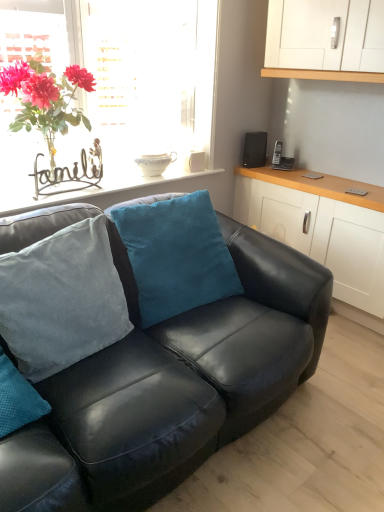
Describe the element at coordinates (255, 149) in the screenshot. I see `black matte speaker at upper right` at that location.

What do you see at coordinates (62, 298) in the screenshot?
I see `velvet blue pillow at center, placed as the second pillow when sorted from right to left` at bounding box center [62, 298].

Identify the location of glass vase at upper left. (118, 95).

In order to face teal velvety pillow at center, placed as the second pillow when sorted from left to right, should I rotate leftwards or rightwards?

It's best to rotate left around 1.633 degrees.

This screenshot has height=512, width=384. What do you see at coordinates (171, 257) in the screenshot?
I see `teal velvety pillow at center, placed as the second pillow when sorted from left to right` at bounding box center [171, 257].

Measure the distance between point (218,386) and camera.

Point (218,386) is 4.85 feet away from camera.

Where is `white ceramic bowl at upper center`? The height and width of the screenshot is (512, 384). white ceramic bowl at upper center is located at coordinates (110, 190).

Locate an element on the screen. white matte cabinet at right is located at coordinates (323, 231).

This screenshot has height=512, width=384. Identify the location of black matte speaker at upper right. (255, 149).

Is matte metal sign at upper left completely or partially outside of white ceramic bowl at upper center?

Yes, matte metal sign at upper left is not within white ceramic bowl at upper center.

Are matte metal sign at upper left and white ceramic bowl at upper center making contact?

matte metal sign at upper left is not next to white ceramic bowl at upper center, and they're not touching.

From a real-world perspective, which is physically above, matte metal sign at upper left or white ceramic bowl at upper center?

matte metal sign at upper left.

Is white matte cabinet at right far away from velvet blue pillow at center, placed as the second pillow when sorted from right to left?

Yes, white matte cabinet at right is far from velvet blue pillow at center, placed as the second pillow when sorted from right to left.

Considering the sizes of objects white matte cabinet at right and velvet blue pillow at center, which is the first pillow in left-to-right order, in the image provided, who is wider, white matte cabinet at right or velvet blue pillow at center, which is the first pillow in left-to-right order,?

white matte cabinet at right is wider.

Between white matte cabinet at right and velvet blue pillow at center, placed as the second pillow when sorted from right to left, which one appears on the right side from the viewer's perspective?

white matte cabinet at right.

Could you measure the distance between white matte cabinet at right and velvet blue pillow at center, which is the first pillow in left-to-right order?

white matte cabinet at right and velvet blue pillow at center, which is the first pillow in left-to-right order, are 1.48 meters apart from each other.

Is black matte speaker at upper right situated inside white ceramic bowl at upper center or outside?

black matte speaker at upper right lies outside white ceramic bowl at upper center.

The height and width of the screenshot is (512, 384). Find the location of `window sill beneath the black matte speaker at upper right (from a real-world perspective)`. window sill beneath the black matte speaker at upper right (from a real-world perspective) is located at coordinates (110, 190).

Would you consider black matte speaker at upper right to be distant from white ceramic bowl at upper center?

That's not correct — black matte speaker at upper right is a little close to white ceramic bowl at upper center.

From a real-world perspective, which is physically below, black matte speaker at upper right or white ceramic bowl at upper center?

white ceramic bowl at upper center is physically lower.

Can you tell me how much teal velvety pillow at center, placed as the second pillow when sorted from left to right, and white ceramic bowl at upper center differ in facing direction?

They differ by 14.3 degrees in their facing directions.

Can you confirm if teal velvety pillow at center, placed as the second pillow when sorted from left to right, is smaller than white ceramic bowl at upper center?

Incorrect, teal velvety pillow at center, placed as the second pillow when sorted from left to right, is not smaller in size than white ceramic bowl at upper center.

Which object is positioned more to the right, teal velvety pillow at center, placed as the second pillow when sorted from left to right, or white ceramic bowl at upper center?

teal velvety pillow at center, placed as the second pillow when sorted from left to right.

Based on the photo, is teal velvety pillow at center, placed as the second pillow when sorted from left to right, thinner than white ceramic bowl at upper center?

Yes, teal velvety pillow at center, placed as the second pillow when sorted from left to right, is thinner than white ceramic bowl at upper center.

The height and width of the screenshot is (512, 384). What are the coordinates of `loudspeaker below the matte metal sign at upper left (from a real-world perspective)` in the screenshot? It's located at (255, 149).

In terms of height, does matte metal sign at upper left look taller or shorter compared to black matte speaker at upper right?

In the image, matte metal sign at upper left appears to be taller than black matte speaker at upper right.

Which object is closer to the camera, matte metal sign at upper left or black matte speaker at upper right?

matte metal sign at upper left is in front.

From the image's perspective, which is above, matte metal sign at upper left or black matte speaker at upper right?

black matte speaker at upper right appears higher in the image.

Can you confirm if white ceramic bowl at upper center is taller than black leather couch at center?

In fact, white ceramic bowl at upper center may be shorter than black leather couch at center.

Would you say white ceramic bowl at upper center is outside black leather couch at center?

Indeed, white ceramic bowl at upper center is completely outside black leather couch at center.

How different are the orientations of white ceramic bowl at upper center and black leather couch at center in degrees?

They differ by 0.013 degrees in their facing directions.

Between white ceramic bowl at upper center and black leather couch at center, which one is positioned behind?

white ceramic bowl at upper center.

Which is behind, velvet blue pillow at center, placed as the second pillow when sorted from right to left, or white matte cabinet at right?

white matte cabinet at right is further from the camera.

Between point (49, 243) and point (263, 192), which one is positioned in front?

The point (49, 243) is in front.

Based on the photo, from the image's perspective, relative to white matte cabinet at right, is velvet blue pillow at center, which is the first pillow in left-to-right order, above or below?

velvet blue pillow at center, which is the first pillow in left-to-right order, is situated lower than white matte cabinet at right in the image.

The image size is (384, 512). What are the coordinates of `window sill on the right of matte metal sign at upper left` in the screenshot? It's located at (110, 190).

From the white matte cabinet at right, count 2nd pillows forward and point to it. Please provide its 2D coordinates.

[(62, 298)]

From the image, which object appears to be nearer to white matte cabinet at right, teal velvety pillow at center, placed as the second pillow when sorted from left to right, or white ceramic bowl at upper center?

white ceramic bowl at upper center.

Estimate the real-world distances between objects in this image. Which object is closer to white ceramic bowl at upper center, black matte speaker at upper right or glass vase at upper left?

The object closer to white ceramic bowl at upper center is glass vase at upper left.

When comparing their distances from velvet blue pillow at center, placed as the second pillow when sorted from right to left, does white matte cabinet at right or white ceramic bowl at upper center seem further?

white matte cabinet at right lies further to velvet blue pillow at center, placed as the second pillow when sorted from right to left, than the other object.

From the image, which object appears to be farther from black matte speaker at upper right, teal velvety pillow at center, the first pillow in the right-to-left sequence, or matte metal sign at upper left?

The object further to black matte speaker at upper right is matte metal sign at upper left.

In the scene shown: Looking at the image, which one is located closer to black leather couch at center, white ceramic bowl at upper center or white matte cabinet at right?

Among the two, white ceramic bowl at upper center is located nearer to black leather couch at center.

From the picture: Considering their positions, is black leather couch at center positioned closer to black matte speaker at upper right than velvet blue pillow at center, placed as the second pillow when sorted from right to left?

Among the two, black leather couch at center is located nearer to black matte speaker at upper right.

Considering their positions, is white ceramic bowl at upper center positioned closer to glass vase at upper left than black leather couch at center?

Among the two, white ceramic bowl at upper center is located nearer to glass vase at upper left.

When comparing their distances from glass vase at upper left, does black leather couch at center or white matte cabinet at right seem further?

black leather couch at center is positioned further to the anchor glass vase at upper left.

In order to click on window between teal velvety pillow at center, placed as the second pillow when sorted from left to right, and black matte speaker at upper right in the front-back direction in this screenshot , I will do `click(118, 95)`.

Locate an element on the screen. window sill between black leather couch at center and black matte speaker at upper right in the front-back direction is located at coordinates (110, 190).

Find the location of a particular element. This screenshot has width=384, height=512. houseplant between glass vase at upper left and white ceramic bowl at upper center vertically is located at coordinates (46, 99).

Image resolution: width=384 pixels, height=512 pixels. What are the coordinates of `window between black leather couch at center and white ceramic bowl at upper center in the front-back direction` in the screenshot? It's located at (118, 95).